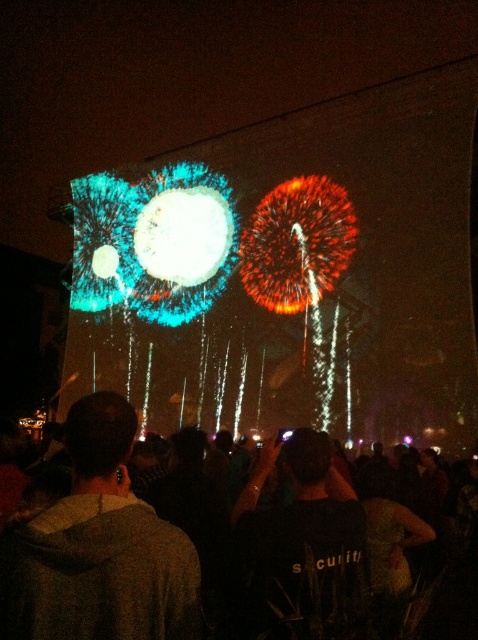
Between black fabric crowd at lower center and brown fabric at lower left, which one has more height?

Standing taller between the two is black fabric crowd at lower center.

Looking at this image, is black fabric crowd at lower center above brown fabric at lower left?

Actually, black fabric crowd at lower center is below brown fabric at lower left.

Where is `black fabric crowd at lower center`? Image resolution: width=478 pixels, height=640 pixels. black fabric crowd at lower center is located at coordinates (98, 572).